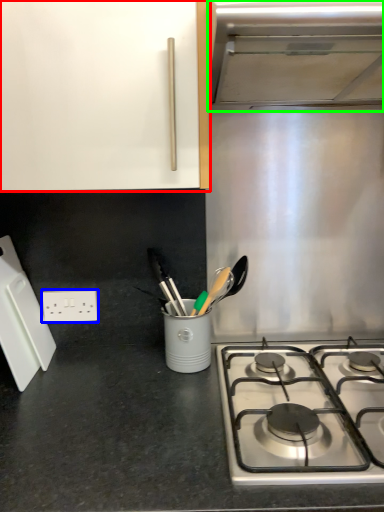
Question: Which object is the closest to the cabinetry (highlighted by a red box)? Choose among these: electric outlet (highlighted by a blue box) or vent (highlighted by a green box).

Choices:
 (A) electric outlet
 (B) vent

Answer: (B)